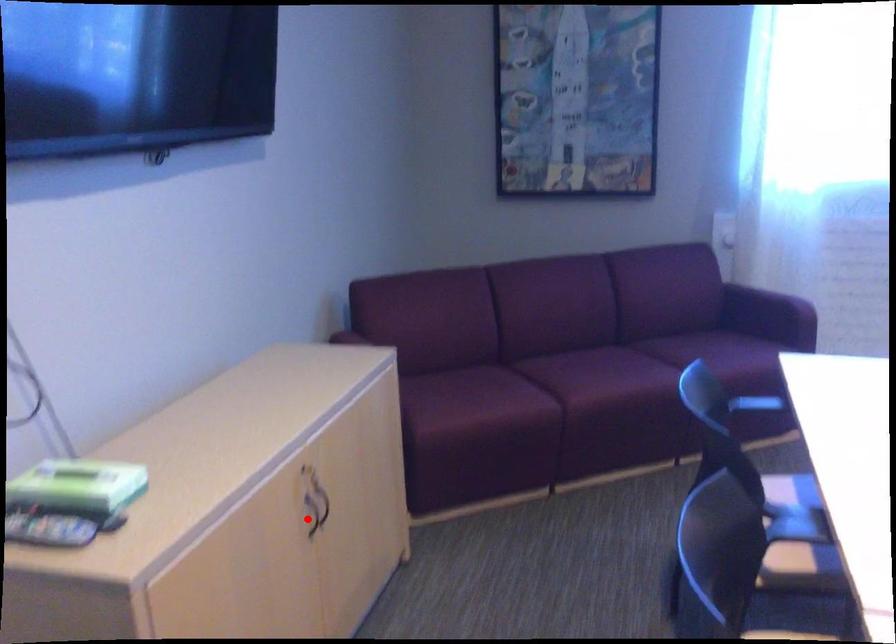
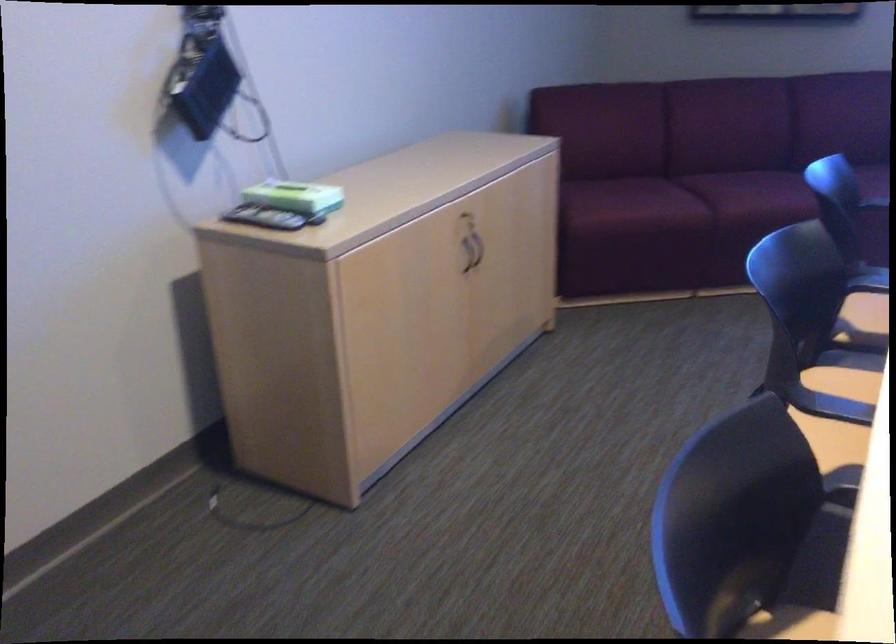
In the second image, find the point that corresponds to the highlighted location in the first image.

(464, 259)